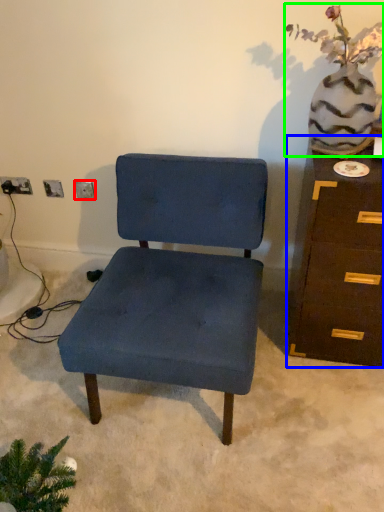
Question: Which is farther away from electric outlet (highlighted by a red box)? chest of drawers (highlighted by a blue box) or floral arrangement (highlighted by a green box)?

Choices:
 (A) chest of drawers
 (B) floral arrangement

Answer: (A)